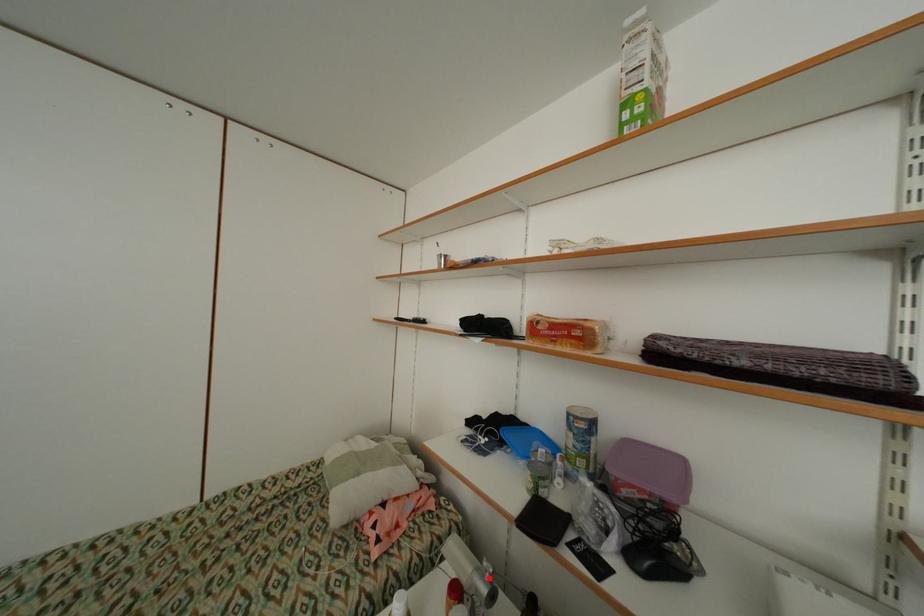
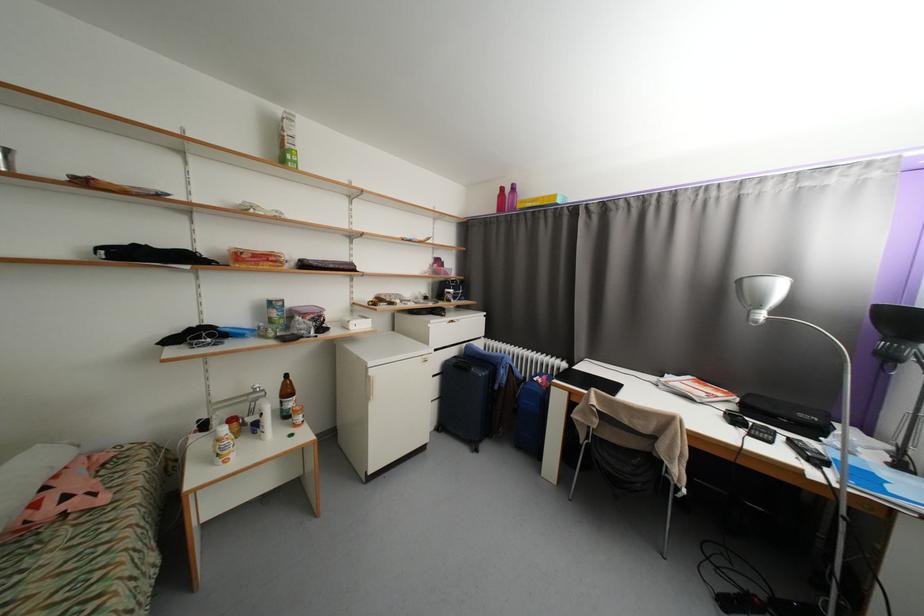
Find the pixel in the second image that matches the highlighted location in the first image.

(261, 392)